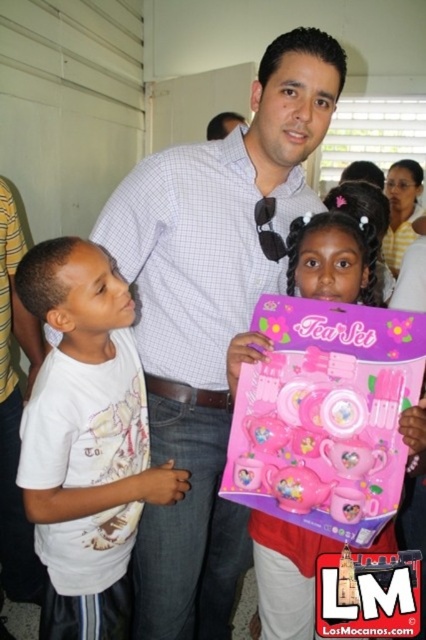
You are a photographer taking a picture of the scene. You want to ensure both the white cotton shirt at left and the pink plastic tea set at center are clearly visible. Which object should you focus on first to ensure the other is also in focus?

You should focus on the white cotton shirt at left first because it is closer to the camera than the pink plastic tea set at center. By focusing on the closer object, the farther object will still be in focus due to the depth of field.

You are standing in the scene and want to hand a gift to the person wearing the white cotton shirt at left. Where should you look to find them?

The white cotton shirt at left is located at point [86,440], so you should look towards that coordinate to find them.

You are a delivery person who needs to place a small package on a surface that can fit it. You see the white cotton shirt at left and the pink plastic tea set at center. Which object can you place the package on?

The white cotton shirt at left has a larger width than the pink plastic tea set at center, so the package can be placed on the white cotton shirt at left.